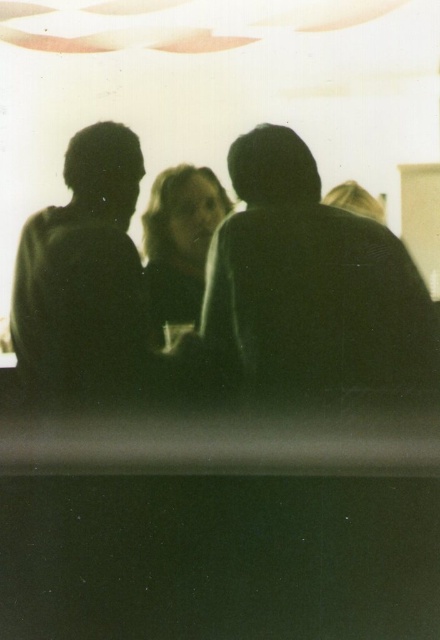
Who is higher up, black matte head at left or smooth skin face at center?

Positioned higher is smooth skin face at center.

Image resolution: width=440 pixels, height=640 pixels. I want to click on black matte head at left, so click(85, 276).

Where is `black matte head at left`? This screenshot has width=440, height=640. black matte head at left is located at coordinates (85, 276).

Is black matte people at center taller than black matte head at left?

Yes.

Is point (316, 348) positioned in front of point (99, 172)?

No, (316, 348) is behind (99, 172).

At what (x,y) coordinates should I click in order to perform the action: click on black matte people at center. Please return your answer as a coordinate pair (x, y). The image size is (440, 640). Looking at the image, I should click on (248, 305).

Is point (308, 161) positioned in front of point (172, 172)?

Yes, point (308, 161) is in front of point (172, 172).

Does black matte people at center appear under smooth skin face at center?

Indeed, black matte people at center is positioned under smooth skin face at center.

Who is more distant from viewer, (399, 365) or (191, 172)?

The point (399, 365) is behind.

Where is `black matte people at center`? black matte people at center is located at coordinates (248, 305).